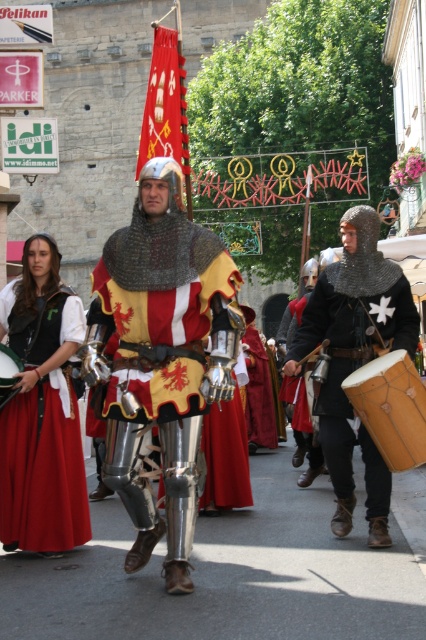
Does metallic chainmail armor at center lie behind metallic chainmail helmet at center?

No.

Does point (112, 250) come farther from viewer compared to point (353, 364)?

No, it is in front of (353, 364).

At what (x,y) coordinates should I click in order to perform the action: click on metallic chainmail armor at center. Please return your answer as a coordinate pair (x, y). Image resolution: width=426 pixels, height=640 pixels. Looking at the image, I should click on (161, 358).

Is metallic chainmail armor at center closer to camera compared to matte red skirt at center?

Yes, metallic chainmail armor at center is in front of matte red skirt at center.

Does metallic chainmail armor at center have a larger size compared to matte red skirt at center?

Yes, metallic chainmail armor at center is bigger than matte red skirt at center.

Is point (176, 184) behind point (74, 461)?

No.

Where is `metallic chainmail armor at center`? metallic chainmail armor at center is located at coordinates (161, 358).

Who is higher up, metallic chainmail helmet at center or wooden drum at center?

wooden drum at center is higher up.

Does metallic chainmail helmet at center lie behind wooden drum at center?

That is False.

Does point (347, 346) come in front of point (2, 381)?

No, it is not.

In order to click on metallic chainmail helmet at center in this screenshot , I will do `click(351, 339)`.